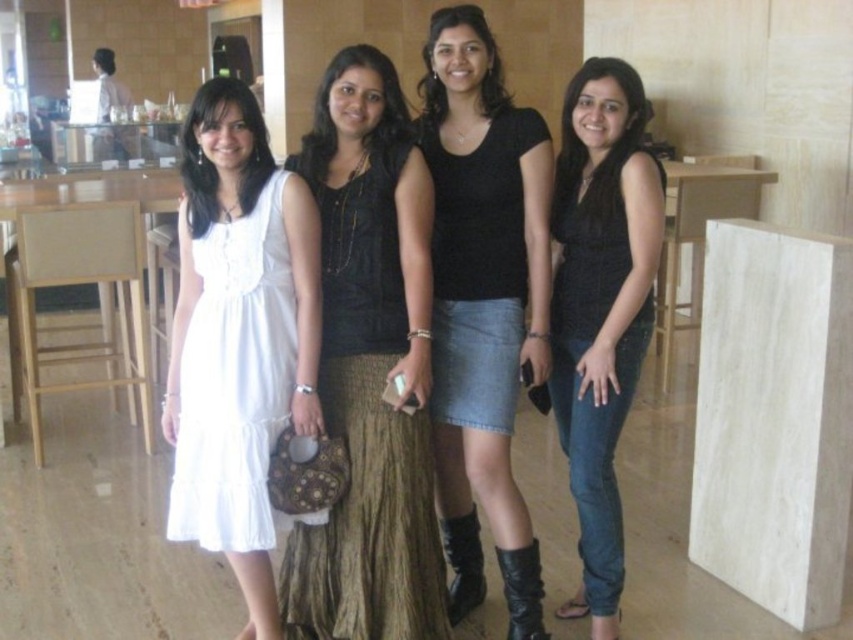
Question: Is the position of white cotton dress at left less distant than that of black matte skirt at center?

Choices:
 (A) yes
 (B) no

Answer: (A)

Question: Estimate the real-world distances between objects in this image. Which object is farther from the black leather cowboy boot at lower center?

Choices:
 (A) black matte skirt at center
 (B) black leather boot at lower center
 (C) black textured top at center
 (D) matte black blouse at center

Answer: (A)

Question: From the image, what is the correct spatial relationship of denim skirt at center in relation to black textured top at center?

Choices:
 (A) above
 (B) below

Answer: (A)

Question: Is brown textured skirt at center thinner than black leather boot at lower center?

Choices:
 (A) yes
 (B) no

Answer: (B)

Question: Which point is closer to the camera?

Choices:
 (A) matte black blouse at center
 (B) black textured dress at center

Answer: (A)

Question: Estimate the real-world distances between objects in this image. Which object is farther from the black leather cowboy boot at lower center?

Choices:
 (A) brown textured skirt at center
 (B) black leather boot at lower center

Answer: (A)